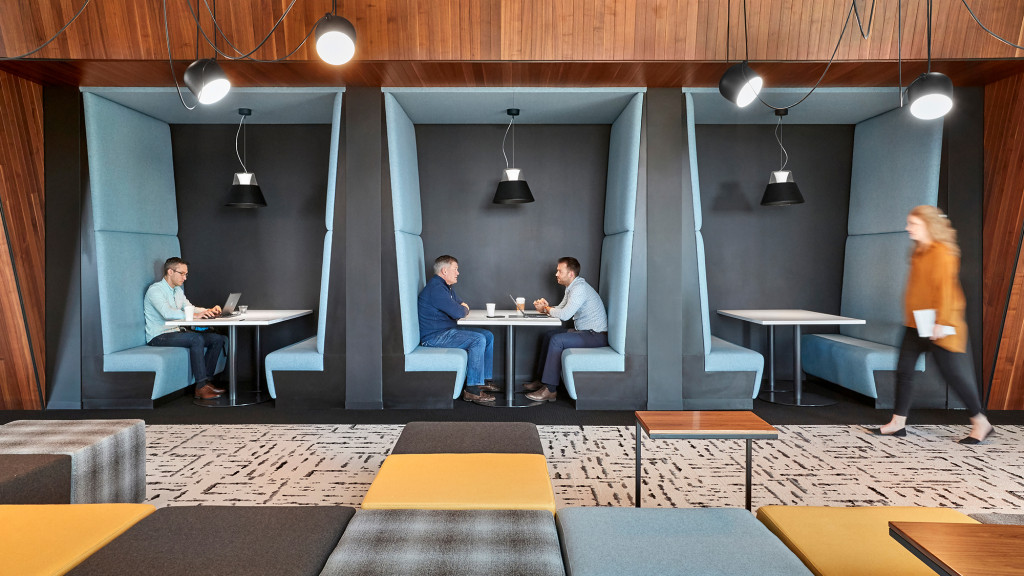
Find the location of a particular element. Image resolution: width=1024 pixels, height=576 pixels. table is located at coordinates (793, 316).